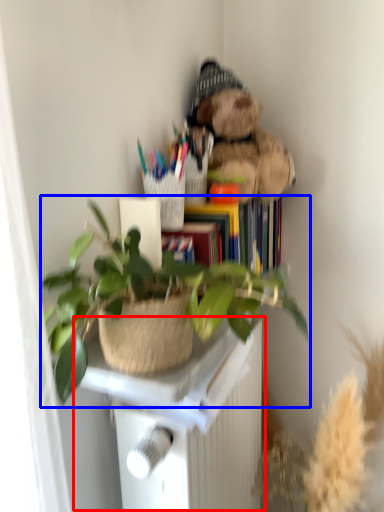
Question: Which of the following is the farthest to the observer, table (highlighted by a red box) or houseplant (highlighted by a blue box)?

Choices:
 (A) table
 (B) houseplant

Answer: (A)